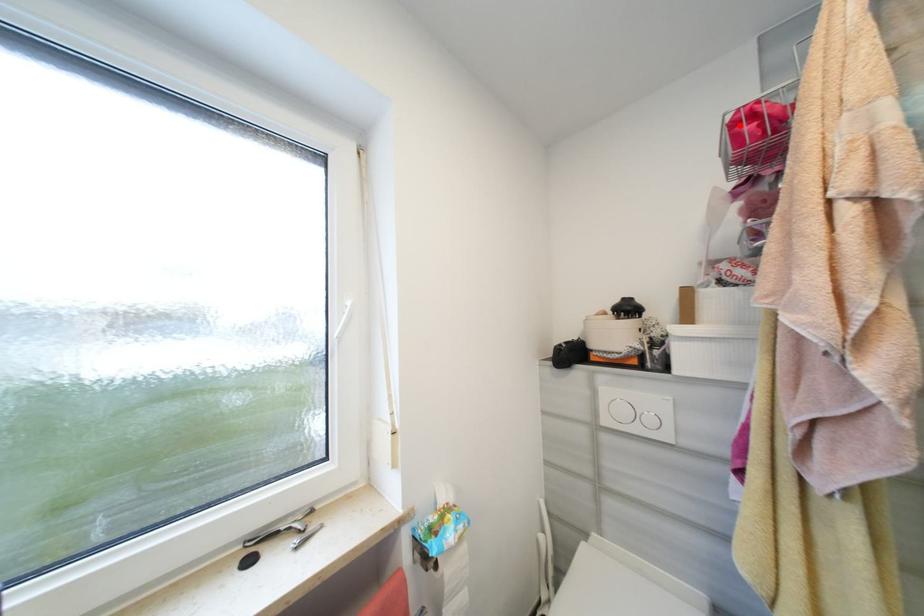
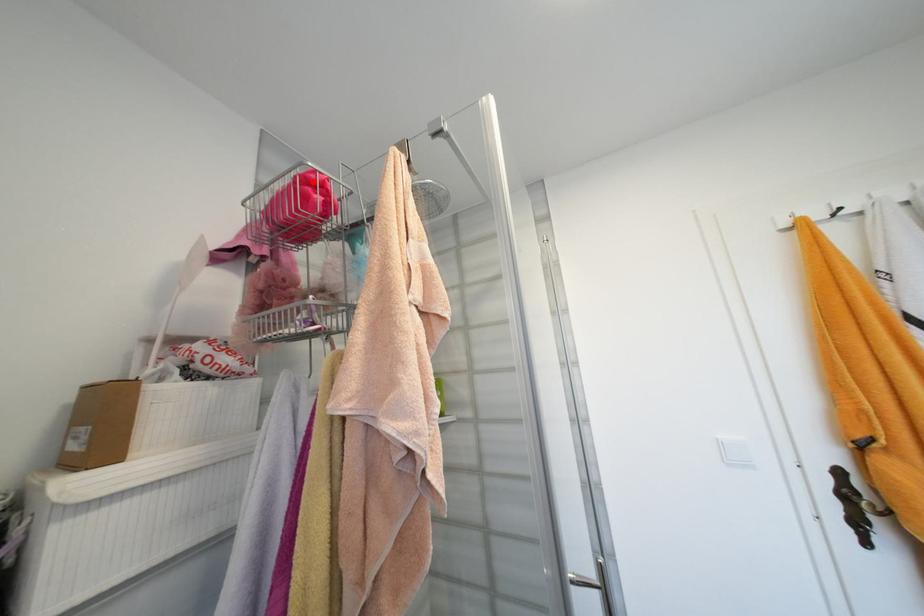
I am providing you with two images of the same scene from different viewpoints. A red point is marked on the first image and another point is marked on the second image. Is the marked point in image1 the same physical position as the marked point in image2?

Yes